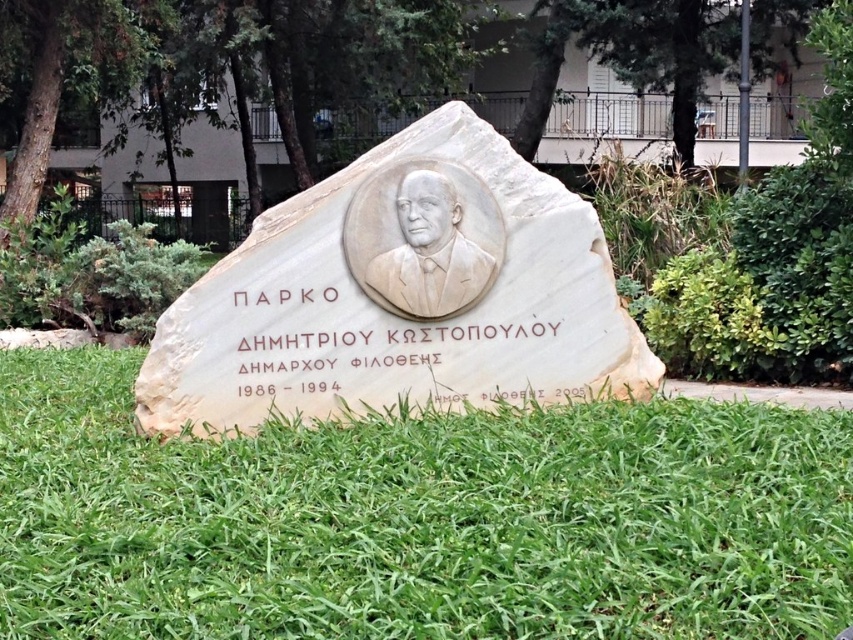
Which of these two, white marble plaque at center or white marble bust at center, stands shorter?

white marble bust at center is shorter.

Does white marble plaque at center have a lesser height compared to white marble bust at center?

In fact, white marble plaque at center may be taller than white marble bust at center.

Does point (410, 152) come behind point (370, 266)?

Yes, point (410, 152) is behind point (370, 266).

Identify the location of white marble plaque at center. (401, 296).

Between green grass at center and white marble plaque at center, which one is positioned higher?

Positioned higher is white marble plaque at center.

What do you see at coordinates (416, 518) in the screenshot?
I see `green grass at center` at bounding box center [416, 518].

This screenshot has height=640, width=853. Find the location of `green grass at center`. green grass at center is located at coordinates (416, 518).

I want to click on green grass at center, so click(416, 518).

Does green grass at center come in front of white marble bust at center?

That is True.

Is point (624, 595) behind point (498, 268)?

No, (624, 595) is closer to viewer.

Who is more forward, (456, 552) or (376, 292)?

Positioned in front is point (456, 552).

The image size is (853, 640). In order to click on green grass at center in this screenshot , I will do `click(416, 518)`.